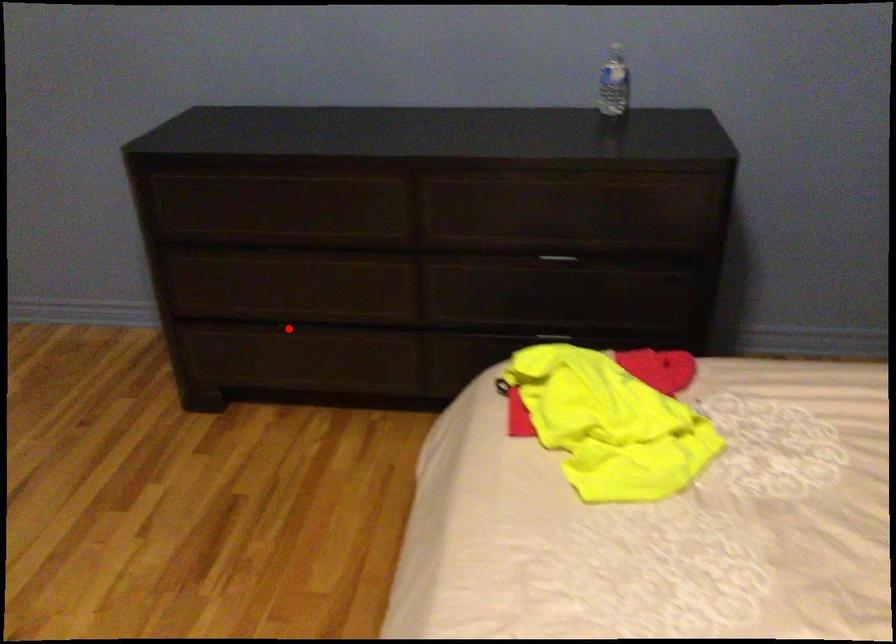
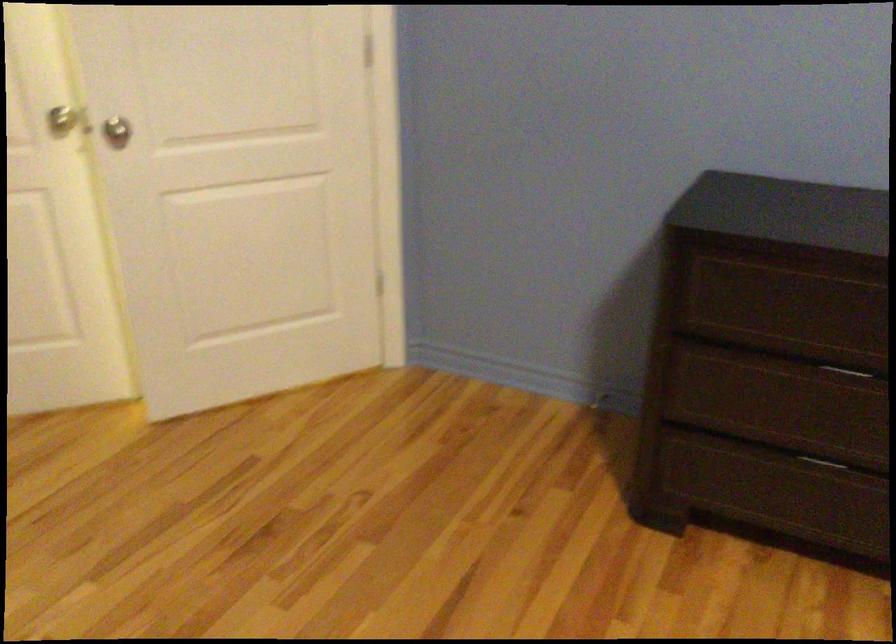
Question: I am providing you with two images of the same scene from different viewpoints. A red point is marked on the first image. Is the red point's position out of view in image 2?

Choices:
 (A) Yes
 (B) No

Answer: (B)